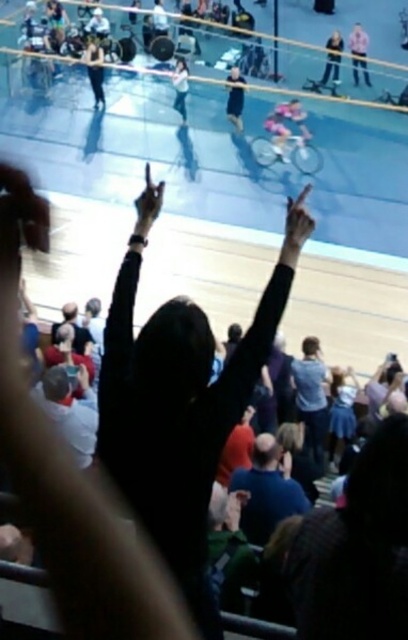
Question: Which of these objects is positioned closest to the light blue jersey at upper center?

Choices:
 (A) dark blue shirt at center
 (B) matte black tank top at upper left
 (C) light blue fabric at center

Answer: (A)

Question: Estimate the real-world distances between objects in this image. Which object is closer to the blue cotton shirt at center?

Choices:
 (A) matte black tank top at upper left
 (B) light blue shirt at center

Answer: (B)

Question: Can you confirm if light blue shirt at center is positioned below light blue jersey at upper center?

Choices:
 (A) no
 (B) yes

Answer: (B)

Question: Can you confirm if blue denim shirt at center is wider than dark blue shirt at center?

Choices:
 (A) yes
 (B) no

Answer: (A)

Question: Which point is farther from the camera taking this photo?

Choices:
 (A) (303, 401)
 (B) (188, 83)
 (C) (354, 72)

Answer: (C)

Question: Can you confirm if matte black tank top at upper left is wider than matte black jacket at upper right?

Choices:
 (A) yes
 (B) no

Answer: (B)